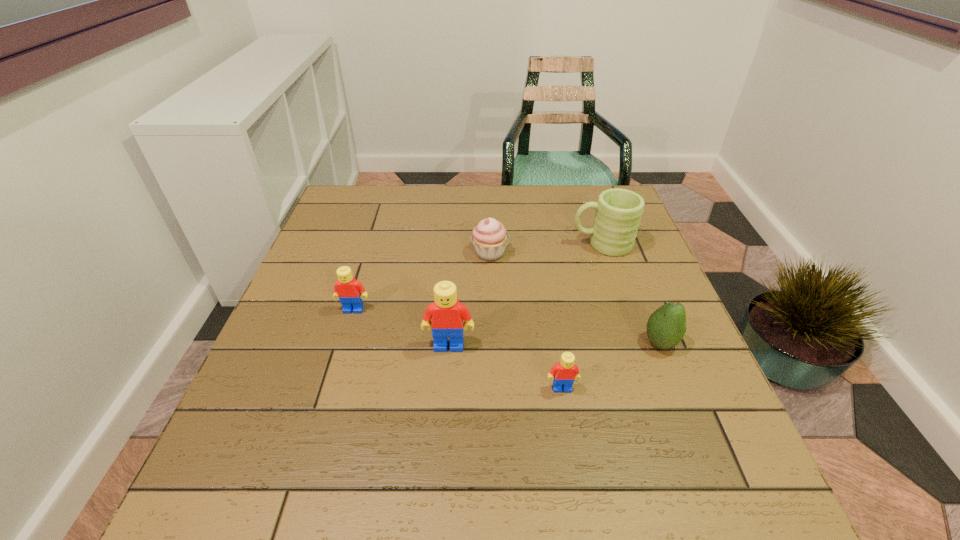
Where is `vacant space in between the cupcake and the second Lego from left to right`? Image resolution: width=960 pixels, height=540 pixels. vacant space in between the cupcake and the second Lego from left to right is located at coordinates (469, 299).

I want to click on vacant area that lies between the avocado and the second Lego from right to left, so click(x=555, y=344).

The image size is (960, 540). What are the coordinates of `free area in between the mug and the tallest object` in the screenshot? It's located at (525, 295).

At what (x,y) coordinates should I click in order to perform the action: click on vacant space that's between the leftmost object and the second Lego from left to right. Please return your answer as a coordinate pair (x, y). This screenshot has width=960, height=540. Looking at the image, I should click on (401, 327).

Point out which object is positioned as the fifth nearest to the rightmost Lego. Please provide its 2D coordinates. Your answer should be formatted as a tuple, i.e. [(x, y)], where the tuple contains the x and y coordinates of a point satisfying the conditions above.

[(350, 291)]

What are the coordinates of `the fourth closest object relative to the mug` in the screenshot? It's located at (564, 373).

Point out which Lego is positioned as the second nearest to the mug. Please provide its 2D coordinates. Your answer should be formatted as a tuple, i.e. [(x, y)], where the tuple contains the x and y coordinates of a point satisfying the conditions above.

[(564, 373)]

Locate an element on the screen. Lego that is the closest to the nearest Lego is located at coordinates (447, 313).

Find the location of `free spot that satisfies the following two spatial constraints: 1. on the side of the mug with the handle; 2. on the face of the tallest Lego`. free spot that satisfies the following two spatial constraints: 1. on the side of the mug with the handle; 2. on the face of the tallest Lego is located at coordinates (636, 346).

Image resolution: width=960 pixels, height=540 pixels. I want to click on vacant space that satisfies the following two spatial constraints: 1. on the side of the mug with the handle; 2. on the face of the tallest object, so click(636, 346).